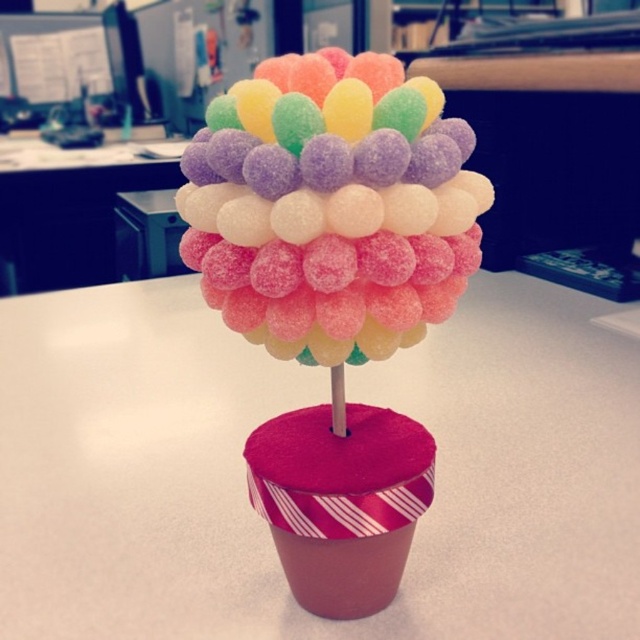
Question: In this image, where is white matte table at center located relative to white glossy table at upper center?

Choices:
 (A) right
 (B) left

Answer: (A)

Question: Which point is closer to the camera taking this photo?

Choices:
 (A) (420, 108)
 (B) (28, 240)

Answer: (A)

Question: Can you confirm if glossy plastic candy at center is positioned to the left of white glossy table at upper center?

Choices:
 (A) no
 (B) yes

Answer: (A)

Question: Which object is farther from the camera taking this photo?

Choices:
 (A) glossy plastic candy at center
 (B) white matte table at center
 (C) white glossy table at upper center

Answer: (C)

Question: Is glossy plastic candy at center positioned behind white glossy table at upper center?

Choices:
 (A) yes
 (B) no

Answer: (B)

Question: Which of the following is the farthest from the observer?

Choices:
 (A) glossy plastic candy at center
 (B) white glossy table at upper center

Answer: (B)